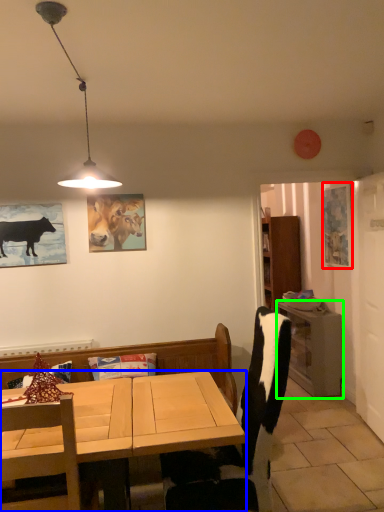
Question: Considering the real-world distances, which object is farthest from picture frame (highlighted by a red box)? desk (highlighted by a blue box) or table (highlighted by a green box)?

Choices:
 (A) desk
 (B) table

Answer: (A)